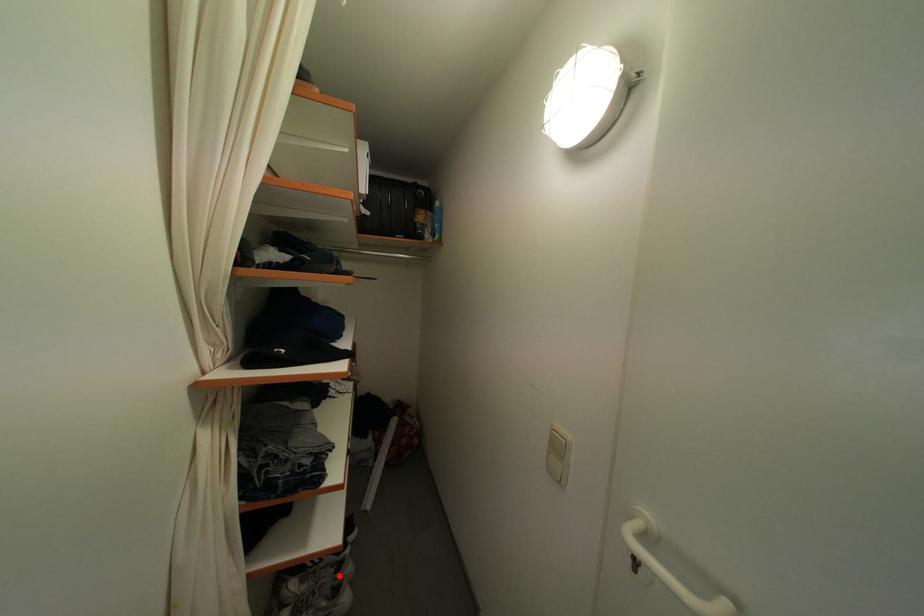
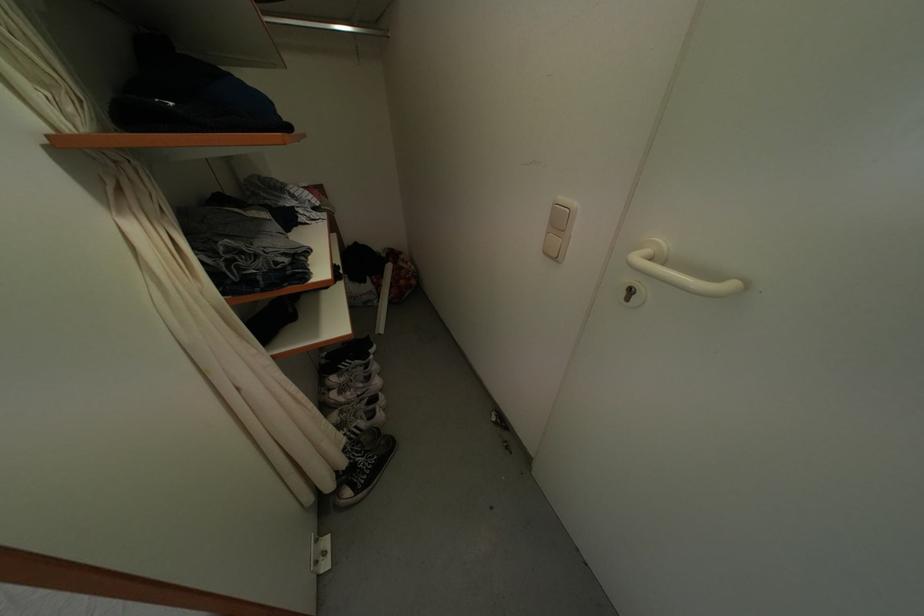
In the second image, find the point that corresponds to the highlighted location in the first image.

(369, 374)